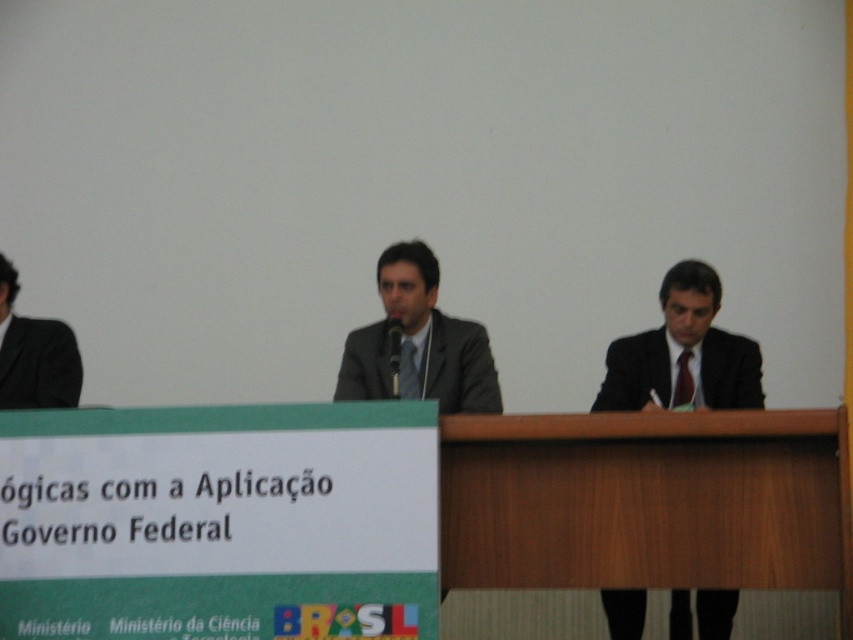
Describe the element at coordinates (418, 342) in the screenshot. I see `matte gray suit at center` at that location.

Can you confirm if matte gray suit at center is positioned to the left of black suit at left?

Incorrect, matte gray suit at center is not on the left side of black suit at left.

Does point (461, 330) come farther from viewer compared to point (45, 333)?

Yes, point (461, 330) is behind point (45, 333).

Identify the location of matte gray suit at center. (418, 342).

Does point (686, 301) come in front of point (418, 298)?

No, (686, 301) is further to viewer.

Does black suit at center appear on the right side of matte gray suit at center?

Correct, you'll find black suit at center to the right of matte gray suit at center.

Who is more forward, (718, 356) or (437, 376)?

Point (437, 376)

Where is `black suit at center`? The width and height of the screenshot is (853, 640). black suit at center is located at coordinates (683, 353).

Between black suit at center and black suit at left, which one has more height?

black suit at center is taller.

Does black suit at center have a lesser width compared to black suit at left?

In fact, black suit at center might be wider than black suit at left.

Which is in front, point (759, 365) or point (67, 330)?

Point (67, 330)

I want to click on black suit at center, so click(x=683, y=353).